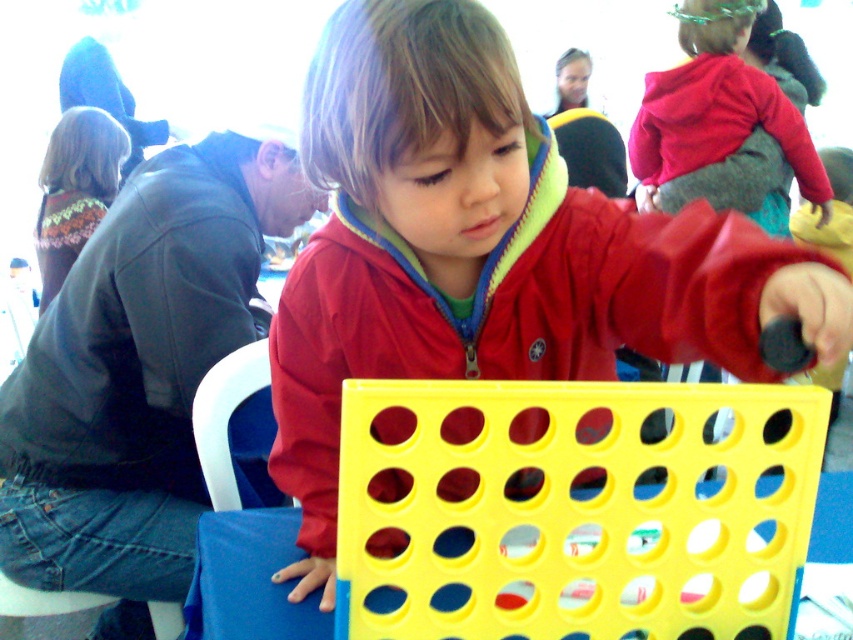
Consider the image. You are designing a storage box for the matte plastic child at center and the yellow plastic table at center. Which object requires a wider storage space based on their dimensions?

The yellow plastic table at center requires a wider storage space because it is thicker than the matte plastic child at center.

From the picture: You are a photographer trying to capture a closeup of the Connect Four game. You notice two points in the scene labeled as point (401, 429) and point (714, 481). Which point should you focus on to get a clearer image of the game board?

Point (401, 429) is closer to the camera than point (714, 481), so focusing on point (401, 429) will provide a clearer image of the game board.

You are a parent observing your child playing Connect Four. You see the matte plastic child at center and the yellow plastic table at center. Which object is closer to you?

The matte plastic child at center is closer to you because it is in front of the yellow plastic table at center.